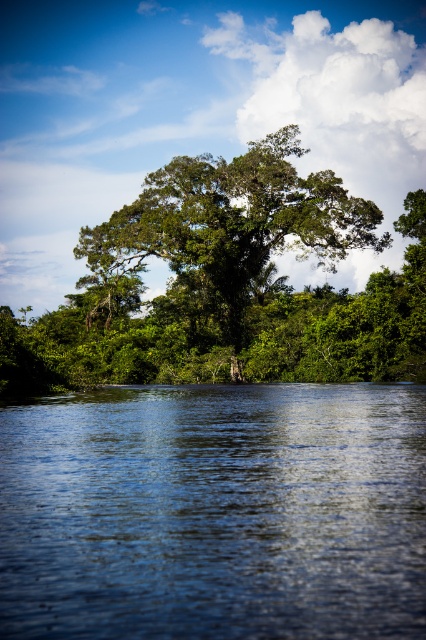
You are standing at the edge of the water and want to take a photo of the green leafy tree at center without the blue liquid water at lower center blocking the view. Is this possible?

The blue liquid water at lower center is in front of the green leafy tree at center, so you cannot take a photo of the green leafy tree at center without the blue liquid water at lower center blocking the view.

You are a hiker who wants to cross the water to reach the tree. Based on the scene, can you safely step on the area at point (x=215, y=513)?

The area at point (x=215, y=513) has blue liquid water at lower center, so stepping there would not be safe as it is water.